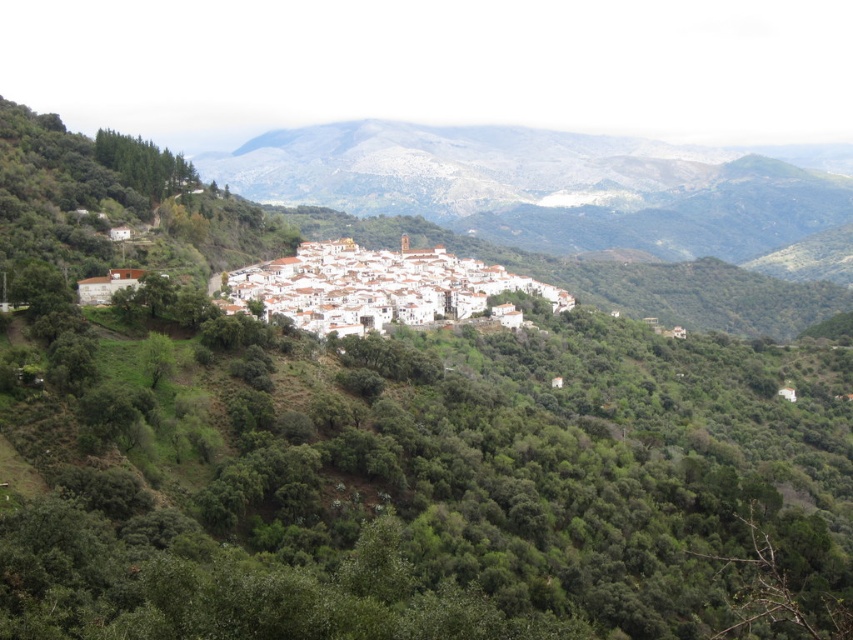
Which is in front, point (456, 189) or point (258, 275)?

Point (258, 275) is more forward.

Consider the image. Can you confirm if green leafy mountain at center is positioned below white matte buildings at center?

Incorrect, green leafy mountain at center is not positioned below white matte buildings at center.

Who is more forward, (730, 180) or (415, 276)?

Point (415, 276) is more forward.

I want to click on green leafy mountain at center, so click(x=560, y=188).